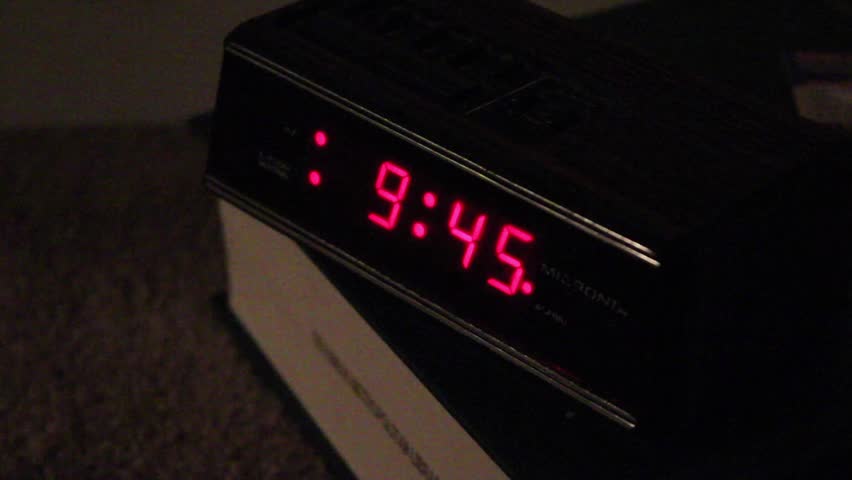
The image size is (852, 480). Identify the location of digital clock. (607, 215).